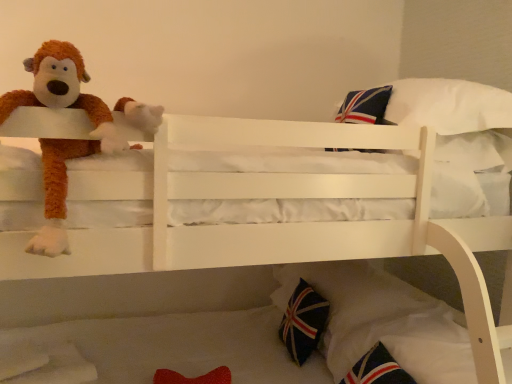
Question: From the image's perspective, relative to fluffy brown monkey at left, is dark blue fabric pillow at lower right above or below?

Choices:
 (A) below
 (B) above

Answer: (A)

Question: Is point (308, 334) positioned closer to the camera than point (60, 64)?

Choices:
 (A) farther
 (B) closer

Answer: (A)

Question: Is dark blue fabric pillow at lower right wider or thinner than fluffy brown monkey at left?

Choices:
 (A) thin
 (B) wide

Answer: (A)

Question: Do you think fluffy brown monkey at left is within dark blue fabric pillow at lower right, or outside of it?

Choices:
 (A) inside
 (B) outside

Answer: (B)

Question: Based on their positions, is fluffy brown monkey at left located to the left or right of dark blue fabric pillow at lower right?

Choices:
 (A) right
 (B) left

Answer: (B)

Question: In the image, is fluffy brown monkey at left positioned in front of or behind dark blue fabric pillow at lower right?

Choices:
 (A) front
 (B) behind

Answer: (A)

Question: From a real-world perspective, is fluffy brown monkey at left physically located above or below dark blue fabric pillow at lower right?

Choices:
 (A) above
 (B) below

Answer: (A)